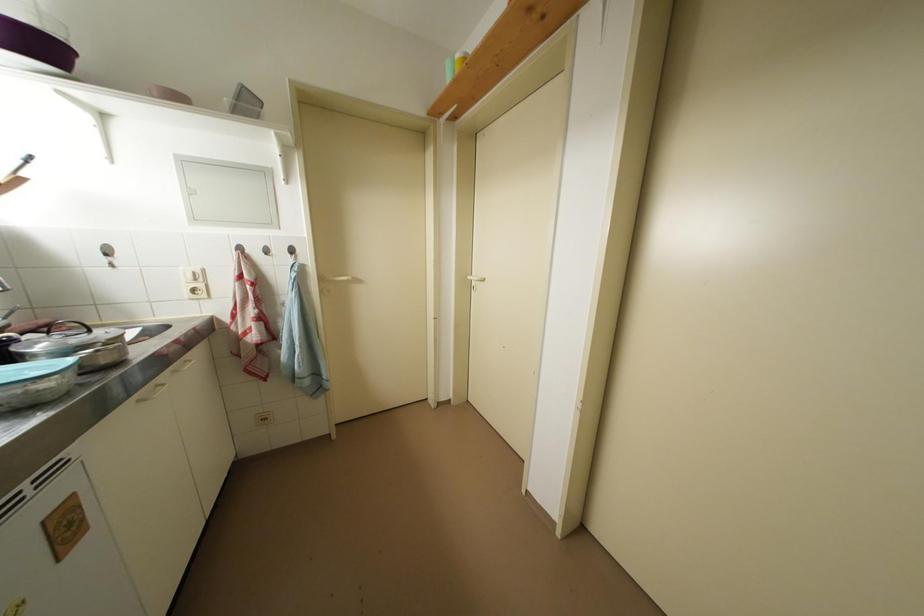
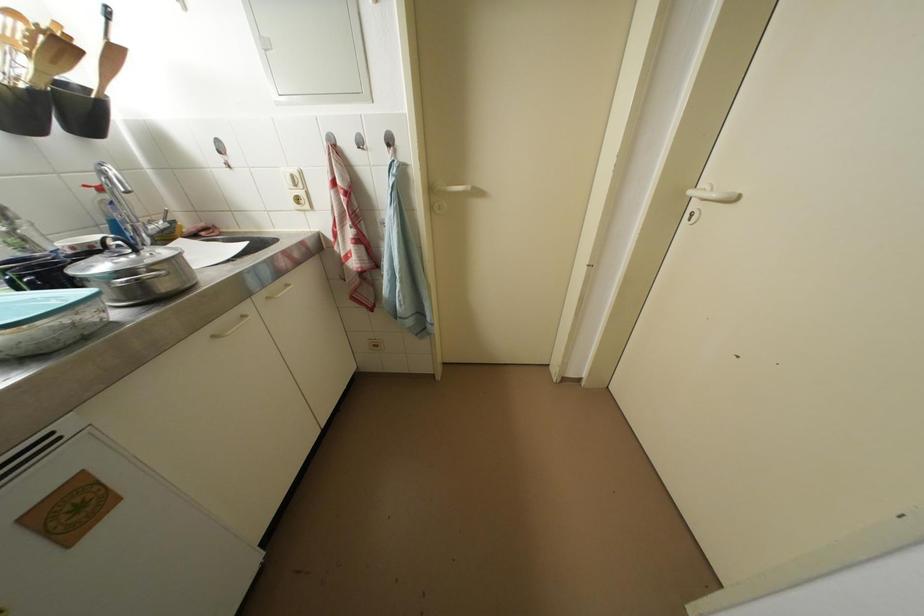
Find the pixel in the second image that matches the point at 476,282 in the first image.

(698, 197)